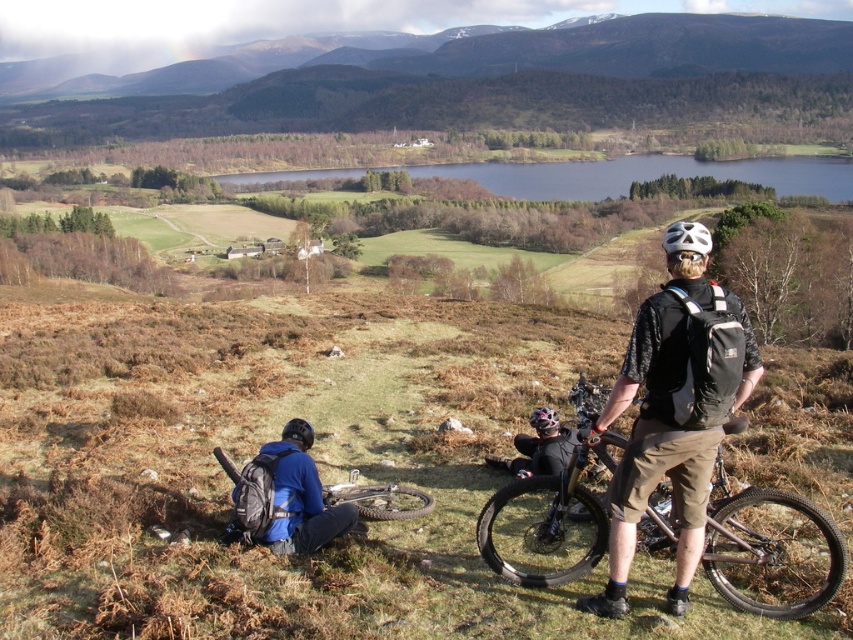
Question: Which point is closer to the camera taking this photo?

Choices:
 (A) (780, 525)
 (B) (242, 524)
 (C) (553, 412)
 (D) (416, 490)

Answer: (B)

Question: Does blue fabric jacket at lower left lie in front of matte black helmet at center?

Choices:
 (A) yes
 (B) no

Answer: (A)

Question: Is matte black bicycle at right bigger than green grassy lake at center?

Choices:
 (A) yes
 (B) no

Answer: (B)

Question: Among these points, which one is nearest to the camera?

Choices:
 (A) (593, 200)
 (B) (773, 612)
 (C) (389, 515)
 (D) (281, 486)

Answer: (B)

Question: Does green grassy lake at center lie behind matte black mountain bike at lower left?

Choices:
 (A) yes
 (B) no

Answer: (A)

Question: Which object is positioned farthest from the matte black bicycle at right?

Choices:
 (A) matte black helmet at lower left
 (B) matte black helmet at center
 (C) matte black mountain bike at lower left

Answer: (A)